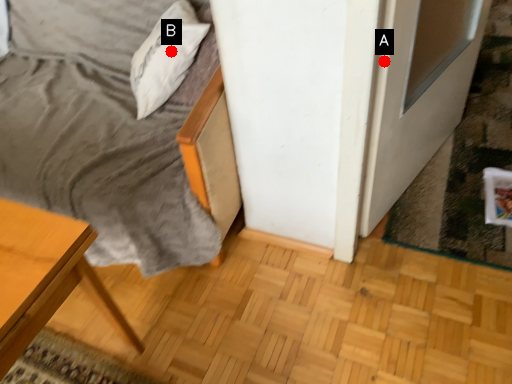
Question: Two points are circled on the image, labeled by A and B beside each circle. Which point is farther to the camera?

Choices:
 (A) A is further
 (B) B is further

Answer: (B)